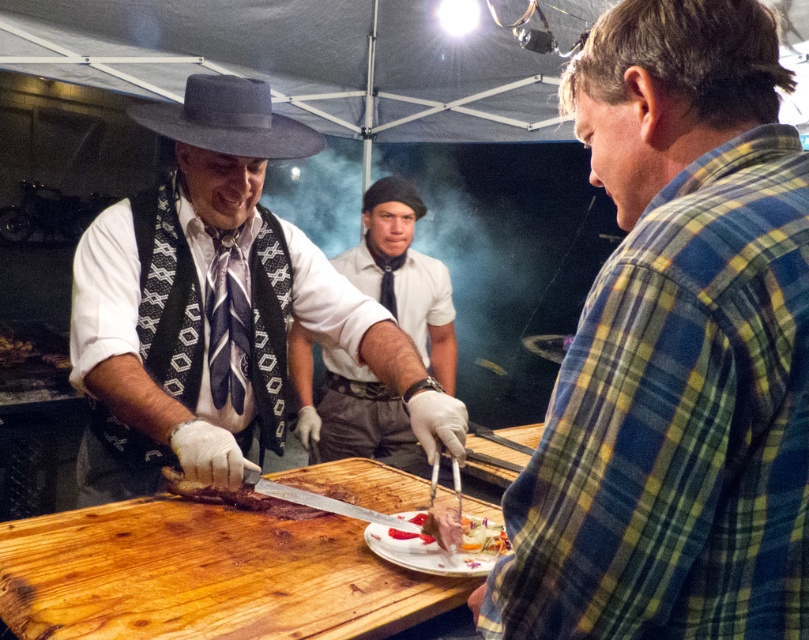
Question: Is matte black vest at center positioned at the back of brown wooden table at center?

Choices:
 (A) yes
 (B) no

Answer: (A)

Question: Among these objects, which one is nearest to the camera?

Choices:
 (A) matte black vest at center
 (B) plaid flannel shirt at right
 (C) brown wooden table at center
 (D) white shirt at center

Answer: (B)

Question: Can you confirm if brown wooden table at center is positioned to the left of smooth white cheese at center?

Choices:
 (A) no
 (B) yes

Answer: (B)

Question: Which is nearer to the brown wooden table at center?

Choices:
 (A) smooth white cheese at center
 (B) matte black vest at center
 (C) plaid flannel shirt at right
 (D) white shirt at center

Answer: (A)

Question: Can you confirm if plaid flannel shirt at right is smaller than brown wooden table at center?

Choices:
 (A) yes
 (B) no

Answer: (A)

Question: Which point is closer to the camera?

Choices:
 (A) brown wooden table at center
 (B) smooth white cheese at center
 (C) matte black vest at center

Answer: (A)